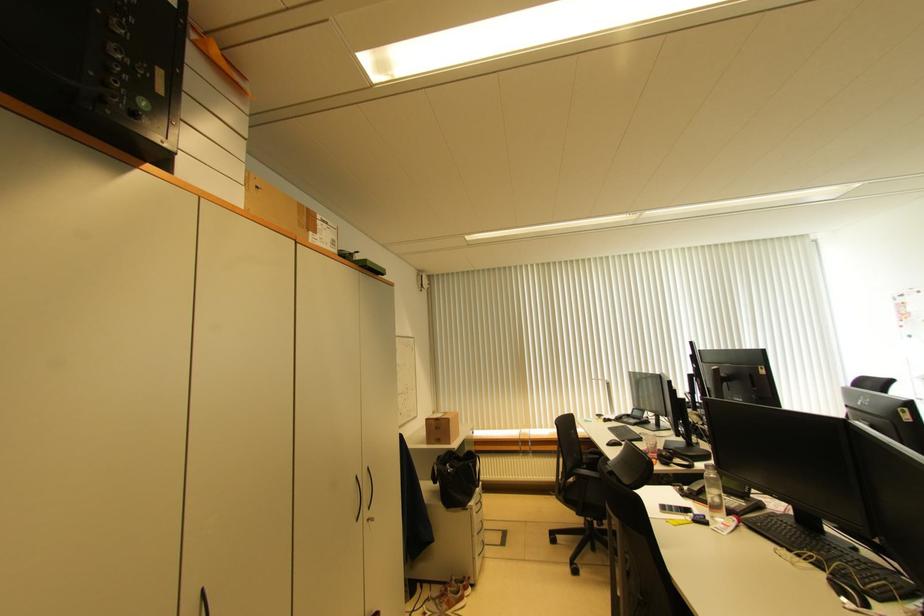
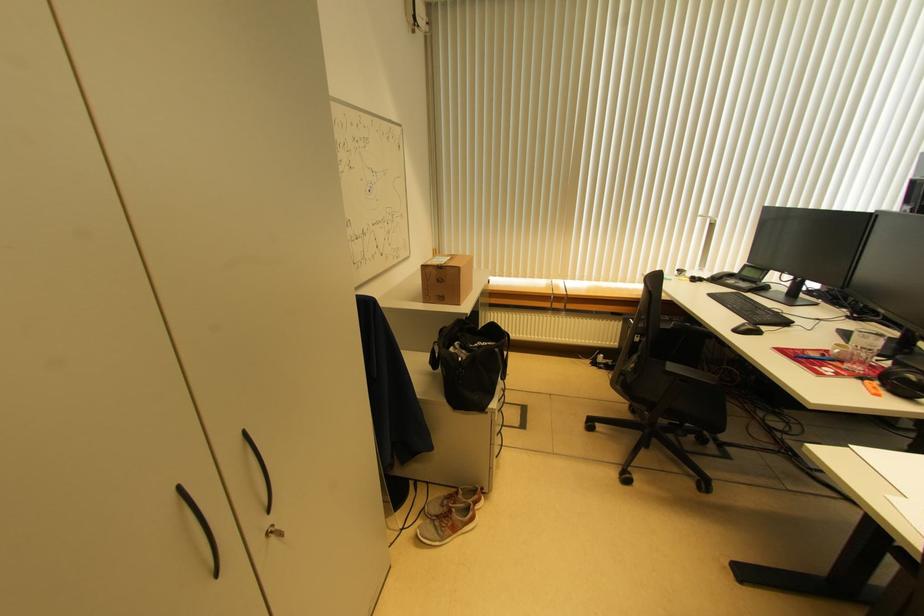
In the second image, find the point that corresponds to the point at 451,422 in the first image.

(459, 272)